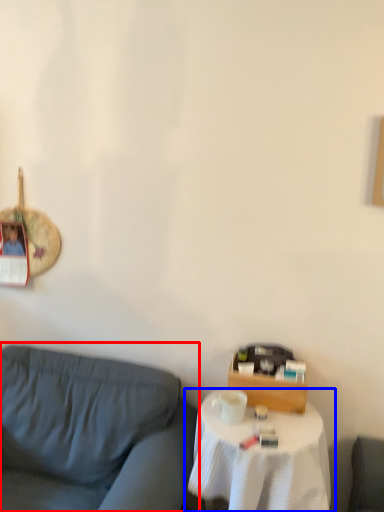
Question: Which object is closer to the camera taking this photo, studio couch (highlighted by a red box) or table (highlighted by a blue box)?

Choices:
 (A) studio couch
 (B) table

Answer: (A)